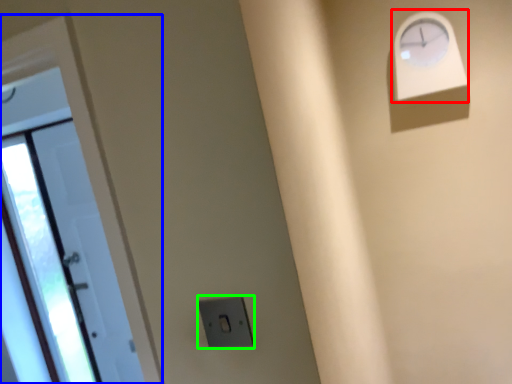
Question: Considering the real-world distances, which object is farthest from clock (highlighted by a red box)? door (highlighted by a blue box) or electric outlet (highlighted by a green box)?

Choices:
 (A) door
 (B) electric outlet

Answer: (A)